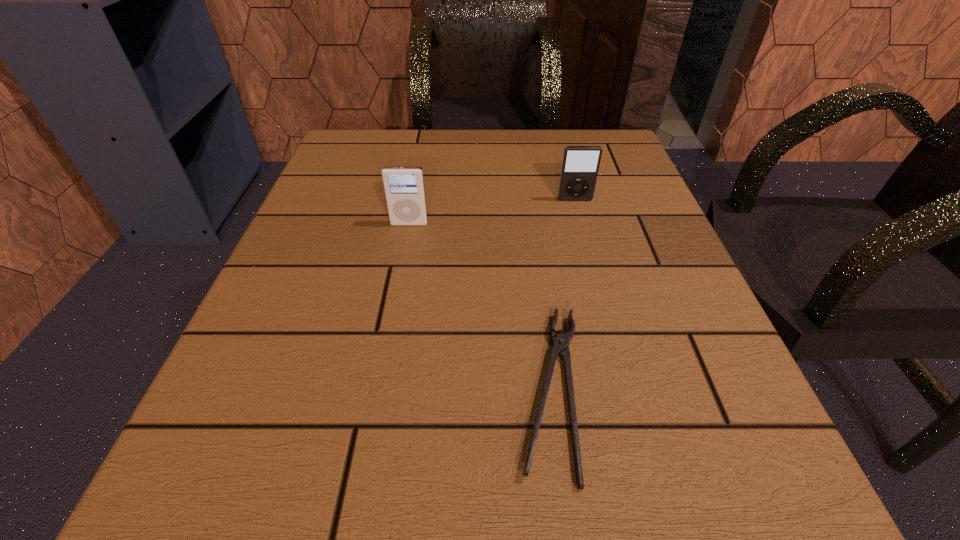
Where is `object positioned at the right edge`? object positioned at the right edge is located at coordinates pos(580,164).

Where is `free region at the far edge of the desktop`? free region at the far edge of the desktop is located at coordinates click(x=514, y=178).

Image resolution: width=960 pixels, height=540 pixels. In order to click on vacant space at the near edge of the desktop in this screenshot , I will do `click(546, 507)`.

Find the location of a particular element. The width and height of the screenshot is (960, 540). vacant space at the left edge of the desktop is located at coordinates (246, 392).

What are the coordinates of `vacant area at the right edge of the desktop` in the screenshot? It's located at (606, 214).

You are a GUI agent. You are given a task and a screenshot of the screen. Output one action in this format:
    pyautogui.click(x=<x>, y=<y>)
    Task: Click on the vacant region at the far left corner of the desktop
    The image size is (960, 540).
    Given the screenshot: What is the action you would take?
    pyautogui.click(x=339, y=147)

I want to click on vacant position at the near left corner of the desktop, so click(x=239, y=530).

Image resolution: width=960 pixels, height=540 pixels. In order to click on vacant space at the far right corner of the desktop in this screenshot , I will do `click(562, 153)`.

Image resolution: width=960 pixels, height=540 pixels. What are the coordinates of `vacant space at the near right corner of the desktop` in the screenshot? It's located at (648, 476).

Find the location of a particular element. This screenshot has width=960, height=540. free area in between the shortest object and the second farthest object is located at coordinates (480, 307).